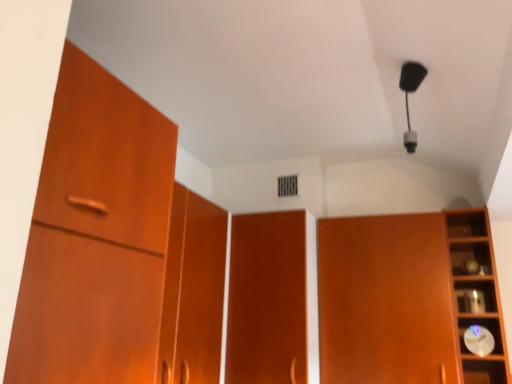
Question: Could you tell me if wooden clock at right is facing matte wood door at center?

Choices:
 (A) no
 (B) yes

Answer: (A)

Question: Is the depth of wooden clock at right less than that of matte wood door at center?

Choices:
 (A) yes
 (B) no

Answer: (A)

Question: Is matte wood door at center surrounded by wooden clock at right?

Choices:
 (A) yes
 (B) no

Answer: (B)

Question: Considering the relative positions of wooden clock at right and matte wood door at center in the image provided, is wooden clock at right to the left of matte wood door at center from the viewer's perspective?

Choices:
 (A) yes
 (B) no

Answer: (B)

Question: From a real-world perspective, is wooden clock at right on matte wood door at center?

Choices:
 (A) no
 (B) yes

Answer: (B)

Question: Considering the relative positions of wooden clock at right and matte wood door at center in the image provided, is wooden clock at right to the right of matte wood door at center from the viewer's perspective?

Choices:
 (A) yes
 (B) no

Answer: (A)

Question: From a real-world perspective, does wooden clock at right sit lower than matte wood cupboard at right?

Choices:
 (A) no
 (B) yes

Answer: (A)

Question: Is wooden clock at right facing towards matte wood cupboard at right?

Choices:
 (A) yes
 (B) no

Answer: (B)

Question: Is wooden clock at right not near matte wood cupboard at right?

Choices:
 (A) yes
 (B) no

Answer: (B)

Question: Does wooden clock at right have a greater height compared to matte wood cupboard at right?

Choices:
 (A) yes
 (B) no

Answer: (B)

Question: Considering the relative positions of wooden clock at right and matte wood cupboard at right in the image provided, is wooden clock at right to the left of matte wood cupboard at right from the viewer's perspective?

Choices:
 (A) yes
 (B) no

Answer: (B)

Question: Could matte wood cupboard at right be considered to be inside wooden clock at right?

Choices:
 (A) no
 (B) yes

Answer: (A)

Question: From the image's perspective, is matte wood cupboard at right located beneath matte wood door at center?

Choices:
 (A) yes
 (B) no

Answer: (A)